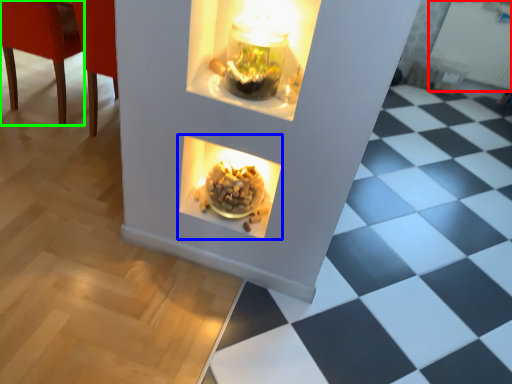
Question: Considering the real-world distances, which object is farthest from radiator (highlighted by a red box)? fireplace (highlighted by a blue box) or chair (highlighted by a green box)?

Choices:
 (A) fireplace
 (B) chair

Answer: (B)